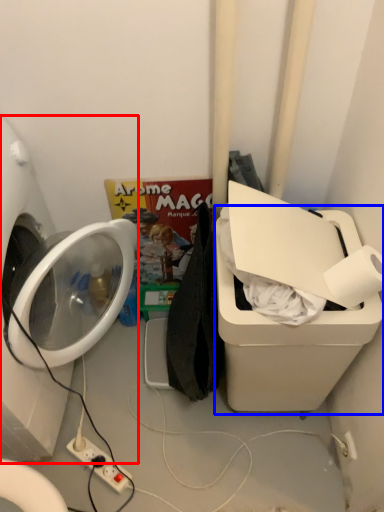
Question: Which of the following is the farthest to the observer, washing machine (highlighted by a red box) or water cooler (highlighted by a blue box)?

Choices:
 (A) washing machine
 (B) water cooler

Answer: (B)